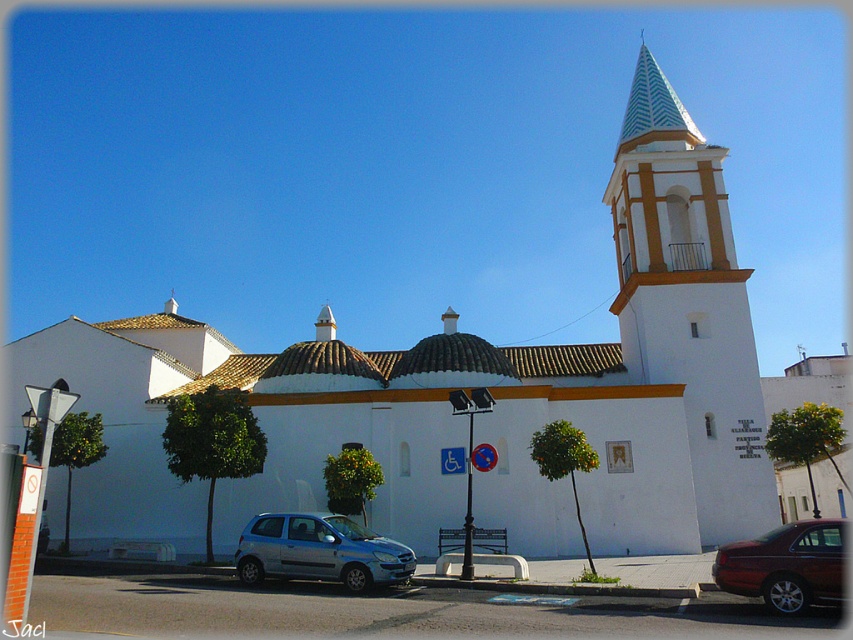
Identify the location of satin silver hatchback at lower center. 318,552.

Is point (270, 516) closer to camera compared to point (822, 528)?

No.

Identify the location of satin silver hatchback at lower center. This screenshot has width=853, height=640. (318, 552).

Does white painted stucco bell tower at upper right come in front of shiny dark red sedan at lower right?

No, white painted stucco bell tower at upper right is further to the viewer.

Looking at this image, can you confirm if white painted stucco bell tower at upper right is taller than shiny dark red sedan at lower right?

Yes.

This screenshot has width=853, height=640. What do you see at coordinates (689, 301) in the screenshot? I see `white painted stucco bell tower at upper right` at bounding box center [689, 301].

Locate an element on the screen. The image size is (853, 640). white painted stucco bell tower at upper right is located at coordinates (689, 301).

Which is above, white painted stucco bell tower at upper right or satin silver hatchback at lower center?

white painted stucco bell tower at upper right is above.

This screenshot has height=640, width=853. What are the coordinates of `white painted stucco bell tower at upper right` in the screenshot? It's located at (689, 301).